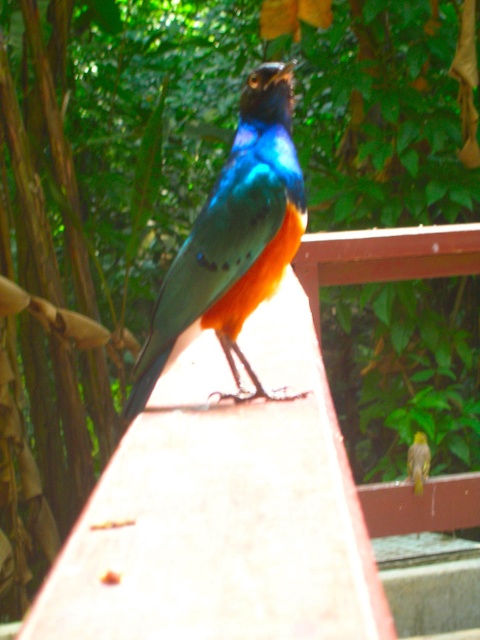
Is point (144, 394) closer to viewer compared to point (424, 456)?

Yes, it is.

Can you confirm if shiny metallic bird at center is wider than yellow textured bird at center?

Yes.

Does point (235, 164) come in front of point (411, 449)?

That is True.

Identify the location of shiny metallic bird at center. This screenshot has height=640, width=480. (235, 240).